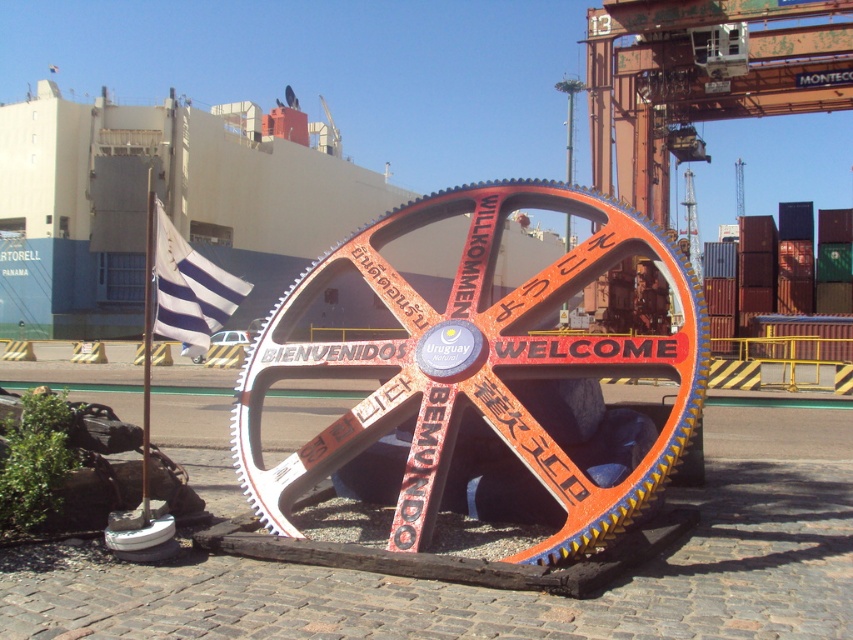
Does orange painted metal gear at center have a lesser width compared to white striped fabric at left?

No.

Locate an element on the screen. The image size is (853, 640). orange painted metal gear at center is located at coordinates (474, 369).

Does point (384, 237) lie behind point (195, 356)?

No, it is in front of (195, 356).

Between orange painted metal gear at center and black rubber tire at center, which one is positioned higher?

Positioned higher is orange painted metal gear at center.

Who is more forward, (x=260, y=412) or (x=192, y=360)?

Positioned in front is point (x=260, y=412).

Where is `orange painted metal gear at center`? Image resolution: width=853 pixels, height=640 pixels. orange painted metal gear at center is located at coordinates (474, 369).

Who is lower down, white striped fabric at left or black rubber tire at center?

black rubber tire at center is below.

This screenshot has width=853, height=640. What do you see at coordinates (189, 289) in the screenshot? I see `white striped fabric at left` at bounding box center [189, 289].

Which is behind, point (222, 316) or point (198, 362)?

The point (198, 362) is more distant.

Locate an element on the screen. white striped fabric at left is located at coordinates (189, 289).